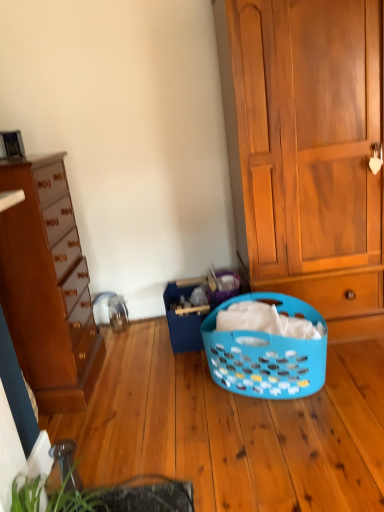
Question: Is blue plastic laundry basket at center facing away from wooden cabinet at right, arranged as the 2th cabinetry when viewed from the left?

Choices:
 (A) no
 (B) yes

Answer: (A)

Question: From the image's perspective, would you say blue plastic laundry basket at center is shown under wooden cabinet at right, which is counted as the 1th cabinetry, starting from the right?

Choices:
 (A) no
 (B) yes

Answer: (B)

Question: Is blue plastic laundry basket at center not within wooden cabinet at right, which is counted as the 1th cabinetry, starting from the right?

Choices:
 (A) no
 (B) yes

Answer: (B)

Question: Does blue plastic laundry basket at center have a smaller size compared to wooden cabinet at right, which is counted as the 1th cabinetry, starting from the right?

Choices:
 (A) yes
 (B) no

Answer: (A)

Question: Is blue plastic laundry basket at center behind wooden cabinet at right, which is counted as the 1th cabinetry, starting from the right?

Choices:
 (A) no
 (B) yes

Answer: (B)

Question: Does point (168, 311) appear closer or farther from the camera than point (59, 294)?

Choices:
 (A) closer
 (B) farther

Answer: (B)

Question: From the image's perspective, is blue plastic laundry basket at center positioned above or below matte brown dresser at left, the 2th cabinetry viewed from the right?

Choices:
 (A) above
 (B) below

Answer: (B)

Question: From a real-world perspective, is blue plastic laundry basket at center positioned above or below matte brown dresser at left, the 1th cabinetry viewed from the left?

Choices:
 (A) below
 (B) above

Answer: (A)

Question: Considering the positions of blue plastic laundry basket at center and matte brown dresser at left, the 1th cabinetry viewed from the left, in the image, is blue plastic laundry basket at center taller or shorter than matte brown dresser at left, the 1th cabinetry viewed from the left,?

Choices:
 (A) tall
 (B) short

Answer: (B)

Question: From the image's perspective, relative to blue plastic laundry basket at center, is wooden cabinet at right, which is counted as the 1th cabinetry, starting from the right, above or below?

Choices:
 (A) above
 (B) below

Answer: (A)

Question: In the image, is wooden cabinet at right, arranged as the 2th cabinetry when viewed from the left, positioned in front of or behind blue plastic laundry basket at center?

Choices:
 (A) front
 (B) behind

Answer: (B)

Question: Is wooden cabinet at right, arranged as the 2th cabinetry when viewed from the left, situated inside blue plastic laundry basket at center or outside?

Choices:
 (A) outside
 (B) inside

Answer: (A)

Question: Visually, is wooden cabinet at right, arranged as the 2th cabinetry when viewed from the left, positioned to the left or to the right of blue plastic laundry basket at center?

Choices:
 (A) right
 (B) left

Answer: (A)

Question: Is blue plastic laundry basket at center bigger or smaller than green leafy plant at lower left?

Choices:
 (A) small
 (B) big

Answer: (B)

Question: Is blue plastic laundry basket at center inside or outside of green leafy plant at lower left?

Choices:
 (A) outside
 (B) inside

Answer: (A)